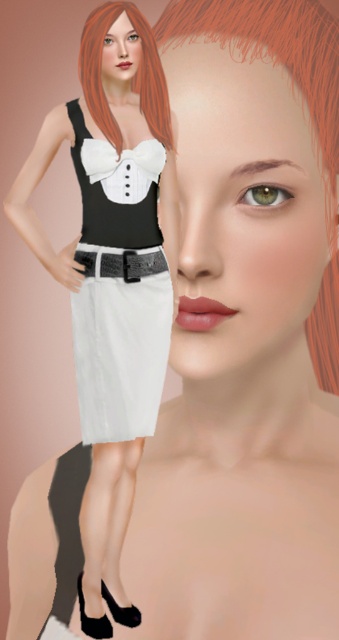
In the scene shown: Is white matte skirt at center positioned in front of blonde hair at center?

No.

In the scene shown: Can you confirm if white matte skirt at center is wider than blonde hair at center?

Incorrect, white matte skirt at center's width does not surpass blonde hair at center's.

Where is `white matte skirt at center`? white matte skirt at center is located at coordinates coord(118,294).

Does white matte skirt at center have a greater width compared to blonde hair at upper left?

Yes, white matte skirt at center is wider than blonde hair at upper left.

Is white matte skirt at center below blonde hair at upper left?

Yes, white matte skirt at center is below blonde hair at upper left.

Does point (121, 413) come farther from viewer compared to point (128, 4)?

Yes, point (121, 413) is behind point (128, 4).

Where is `white matte skirt at center`? white matte skirt at center is located at coordinates (118, 294).

Is blonde hair at upper left smaller than black leather belt at center?

Actually, blonde hair at upper left might be larger than black leather belt at center.

Looking at this image, is blonde hair at upper left taller than black leather belt at center?

Yes, blonde hair at upper left is taller than black leather belt at center.

Locate an element on the screen. The height and width of the screenshot is (640, 339). blonde hair at upper left is located at coordinates (131, 80).

Identify the location of blonde hair at upper left. The height and width of the screenshot is (640, 339). point(131,80).